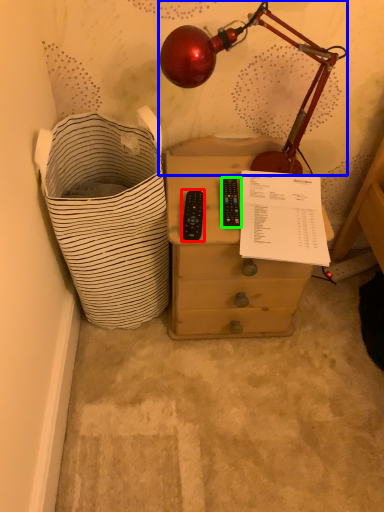
Question: Which is farther away from control (highlighted by a red box)? lamp (highlighted by a blue box) or control (highlighted by a green box)?

Choices:
 (A) lamp
 (B) control

Answer: (A)